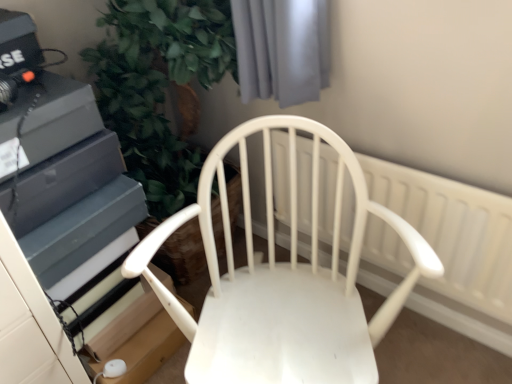
Question: Based on their sizes in the image, would you say white plastic radiator at center is bigger or smaller than white matte chair at center?

Choices:
 (A) big
 (B) small

Answer: (B)

Question: Is white plastic radiator at center wider or thinner than white matte chair at center?

Choices:
 (A) wide
 (B) thin

Answer: (B)

Question: Visually, is white plastic radiator at center positioned to the left or to the right of white matte chair at center?

Choices:
 (A) right
 (B) left

Answer: (A)

Question: From a real-world perspective, is white matte chair at center physically located above or below white plastic radiator at center?

Choices:
 (A) above
 (B) below

Answer: (A)

Question: In the image, is white matte chair at center on the left side or the right side of white plastic radiator at center?

Choices:
 (A) left
 (B) right

Answer: (A)

Question: Considering their positions, is white matte chair at center located in front of or behind white plastic radiator at center?

Choices:
 (A) front
 (B) behind

Answer: (A)

Question: Is point (257, 375) positioned closer to the camera than point (481, 276)?

Choices:
 (A) closer
 (B) farther

Answer: (A)